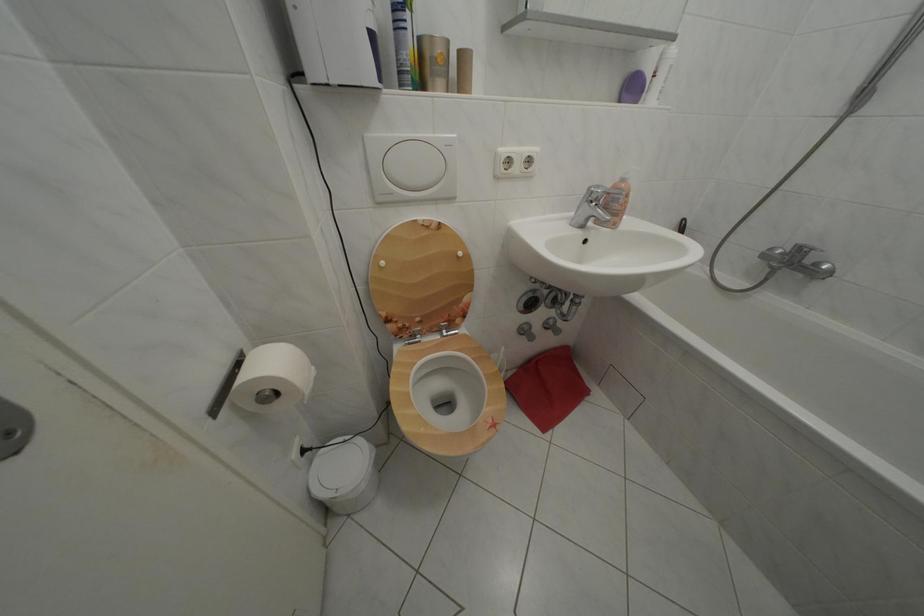
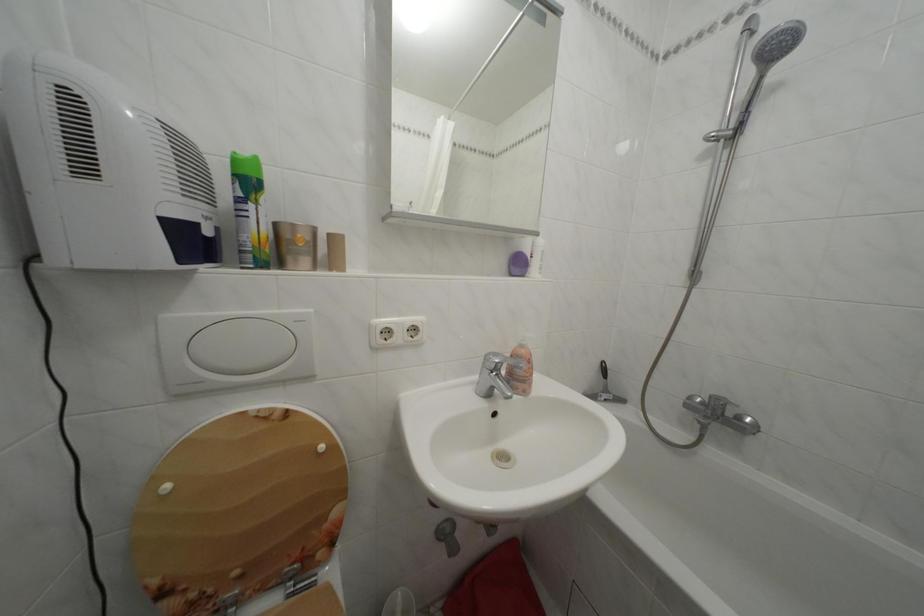
The point at (631, 187) is marked in the first image. Where is the corresponding point in the second image?

(530, 352)